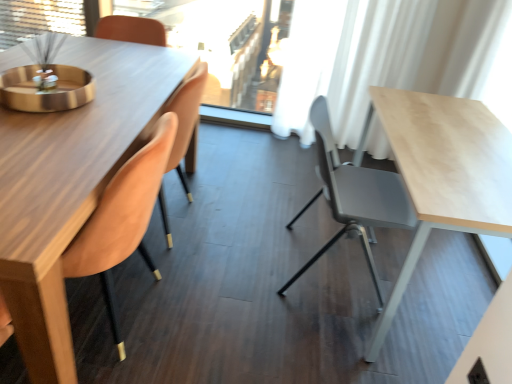
Where is `empty space that is to the right of matte gray chair at center, the 2th chair positioned from the left`? The height and width of the screenshot is (384, 512). empty space that is to the right of matte gray chair at center, the 2th chair positioned from the left is located at coordinates (442, 283).